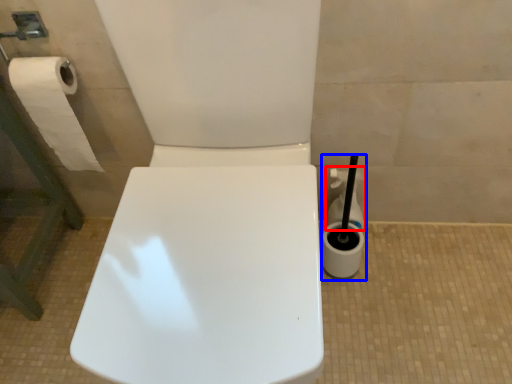
Question: Which object is further to the camera taking this photo, cleaning product (highlighted by a red box) or cleaning product (highlighted by a blue box)?

Choices:
 (A) cleaning product
 (B) cleaning product

Answer: (A)